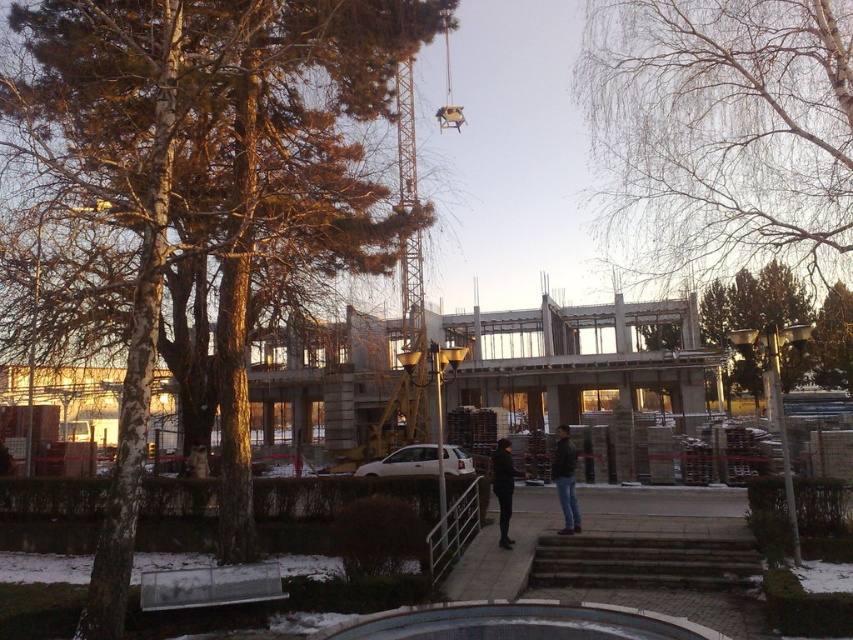
Question: Does green leafy tree at center have a lesser width compared to dark matte coat at center?

Choices:
 (A) no
 (B) yes

Answer: (A)

Question: Among these objects, which one is farthest from the camera?

Choices:
 (A) dark blue jeans at center
 (B) green leafy tree at center
 (C) dark matte coat at center
 (D) dark gray concrete stairs at center

Answer: (C)

Question: Does bare branches at upper center have a greater width compared to green leafy tree at center?

Choices:
 (A) yes
 (B) no

Answer: (B)

Question: Which object is the closest to the dark gray concrete stairs at center?

Choices:
 (A) bare branches at upper center
 (B) dark matte coat at center

Answer: (A)

Question: Is bare branches at upper center above dark blue jeans at center?

Choices:
 (A) yes
 (B) no

Answer: (A)

Question: Which of the following is the closest to the observer?

Choices:
 (A) (541, 572)
 (B) (569, 445)
 (C) (752, 42)
 (D) (850, 321)

Answer: (A)